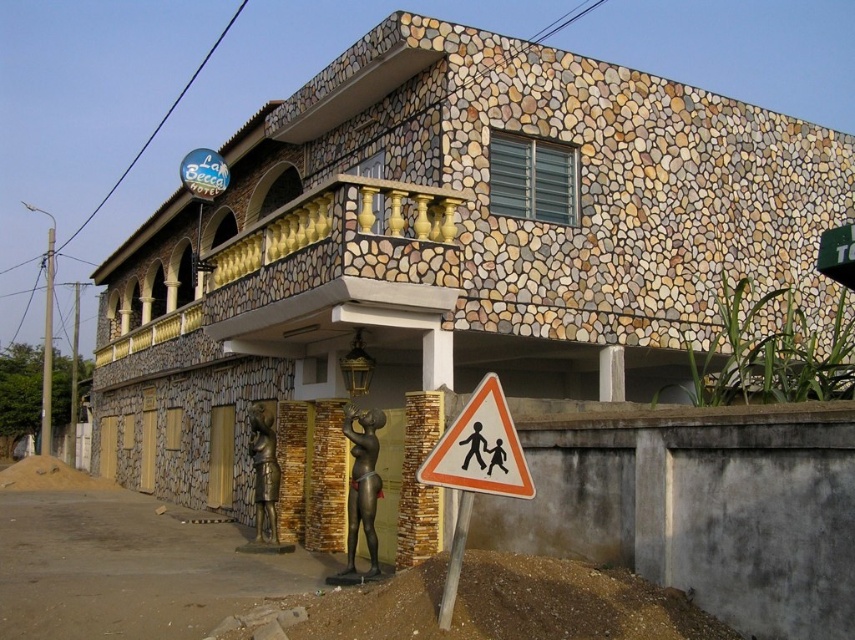
Question: Can you confirm if metallic pole at left is thinner than metallic pole at lower center?

Choices:
 (A) no
 (B) yes

Answer: (A)

Question: Does bronze statue at lower center have a greater width compared to metallic pole at left?

Choices:
 (A) no
 (B) yes

Answer: (A)

Question: Can you confirm if metallic pole at lower center is thinner than brushed metal pole at left?

Choices:
 (A) yes
 (B) no

Answer: (A)

Question: Which of the following is the closest to the observer?

Choices:
 (A) metallic pole at left
 (B) metallic pole at lower center
 (C) bronze statue at lower center

Answer: (B)

Question: Which is nearer to the brushed metal pole at left?

Choices:
 (A) bronze statue at lower center
 (B) white plastic triangle at lower center

Answer: (A)

Question: Estimate the real-world distances between objects in this image. Which object is farther from the metallic pole at left?

Choices:
 (A) metallic pole at lower center
 (B) bronze statue at center

Answer: (A)